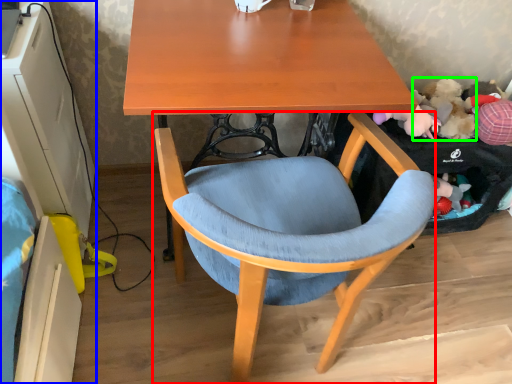
Question: Considering the real-world distances, which object is farthest from chair (highlighted by a red box)? computer desk (highlighted by a blue box) or toy (highlighted by a green box)?

Choices:
 (A) computer desk
 (B) toy

Answer: (B)